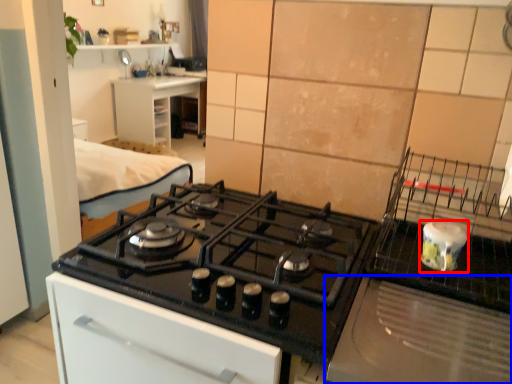
Question: Which object appears closest to the camera in this image, kitchen appliance (highlighted by a red box) or home appliance (highlighted by a blue box)?

Choices:
 (A) kitchen appliance
 (B) home appliance

Answer: (B)